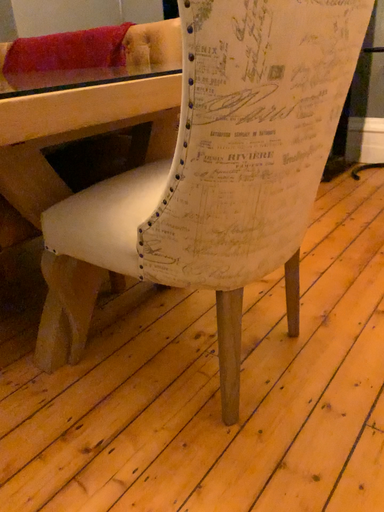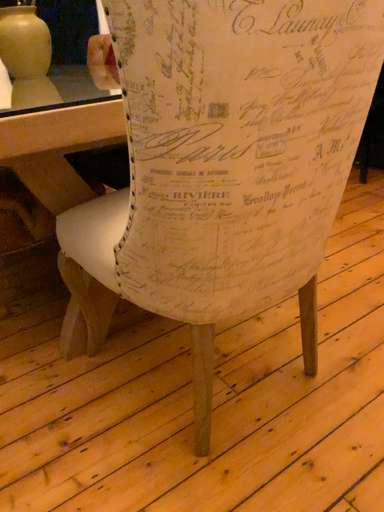
Question: Which way did the camera rotate in the video?

Choices:
 (A) rotated left
 (B) rotated right

Answer: (A)